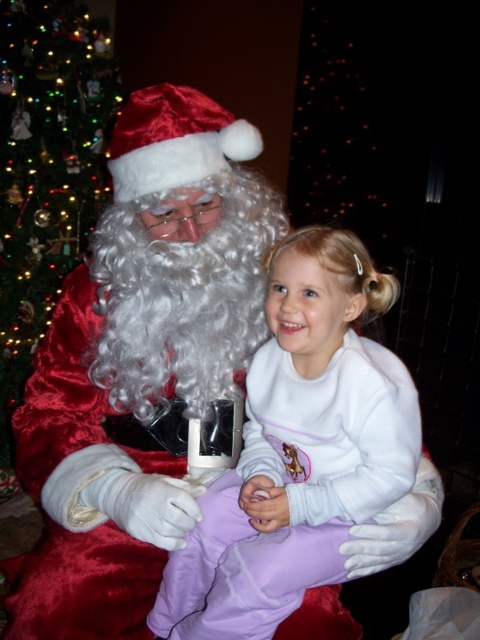
Is point (373, 449) closer to viewer compared to point (58, 253)?

Yes.

Who is higher up, white fleece onesie at center or green velvet christmas tree at left?

Positioned higher is green velvet christmas tree at left.

The height and width of the screenshot is (640, 480). I want to click on white fleece onesie at center, so click(299, 449).

In order to click on white fleece onesie at center in this screenshot , I will do `click(299, 449)`.